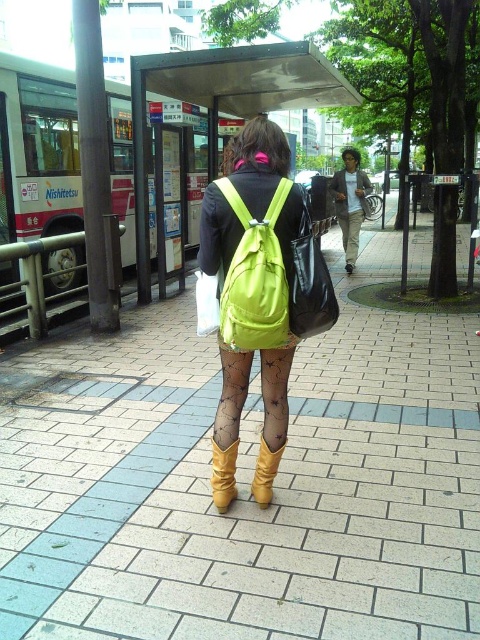
You are standing at the bus stop and want to know which of the two points, point (285, 228) or point (254, 483), is closer to you. Based on the scene description, which point is nearer?

Point (285, 228) is closer to the viewer than point (254, 483).

You are standing at the bus stop and want to locate the point at coordinates (262,285). According to the scene, where exactly is this point located?

The point at coordinates (262,285) is located on the matte green backpack at center.